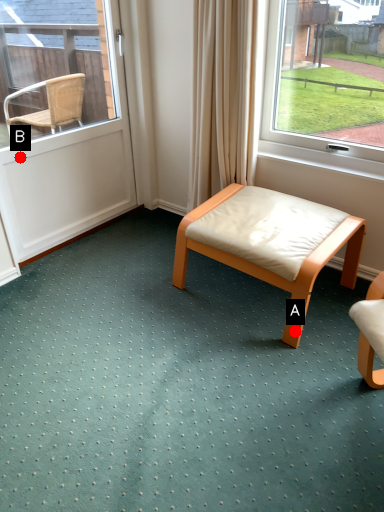
Question: Two points are circled on the image, labeled by A and B beside each circle. Which point is further to the camera?

Choices:
 (A) A is further
 (B) B is further

Answer: (B)